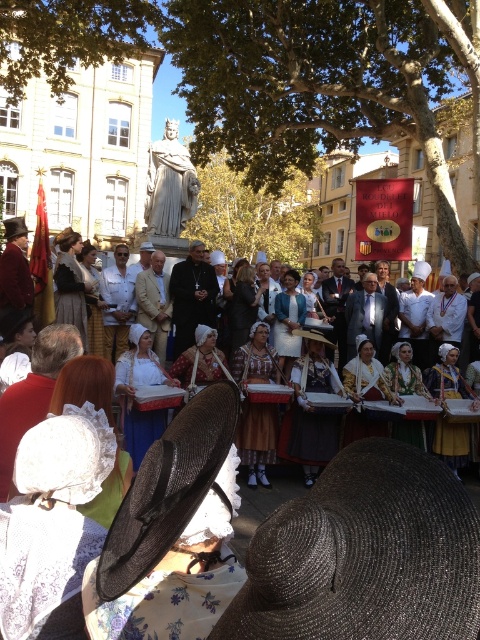
You are standing in the town square and see two straw hats. The silver metallic straw hat at lower center and the black straw hat at lower left. Which one is positioned to the right of the other?

The silver metallic straw hat at lower center is positioned to the right of the black straw hat at lower left.